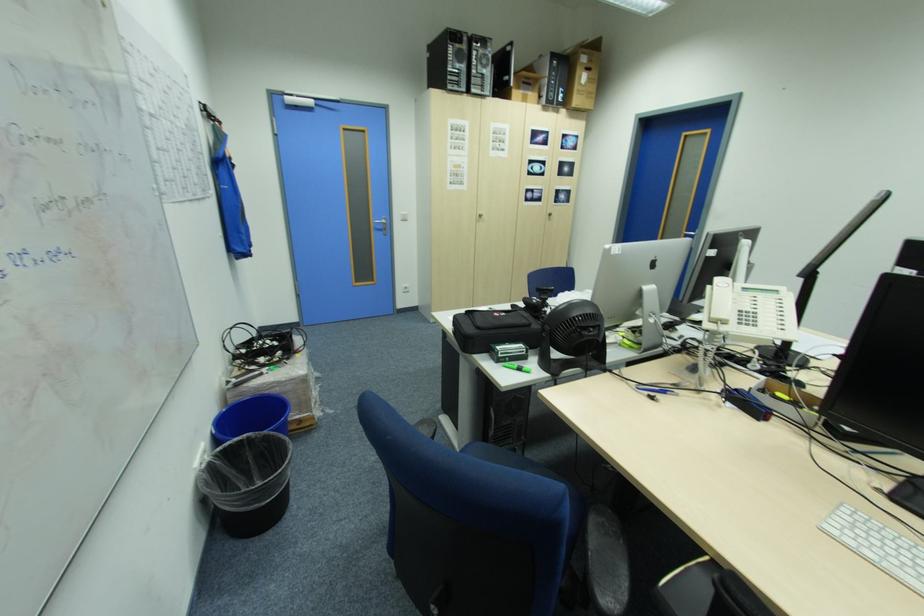
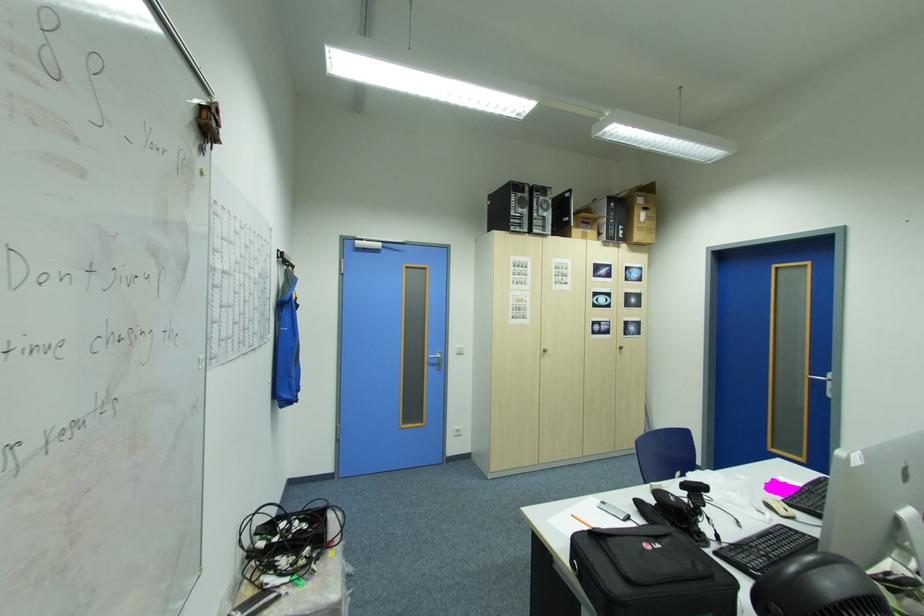
The point at [511,315] is marked in the first image. Where is the corresponding point in the second image?

(665, 546)